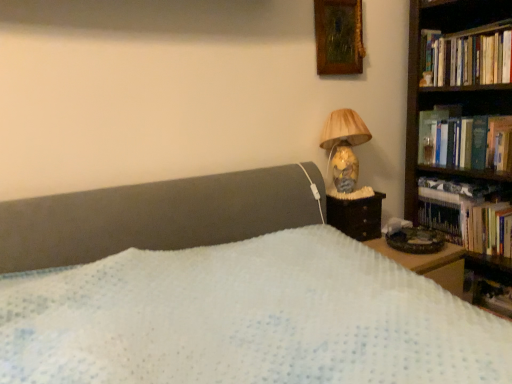
Locate an element on the screen. The image size is (512, 384). free space above dark wood nightstand at right (from a real-world perspective) is located at coordinates (353, 193).